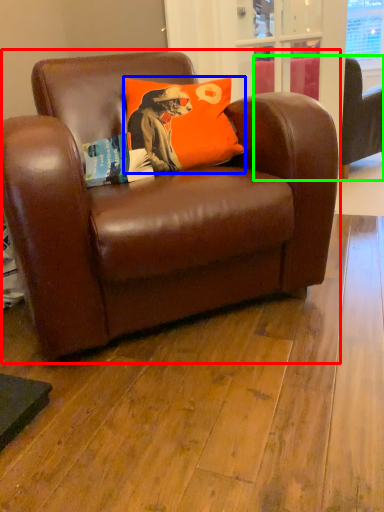
Question: Estimate the real-world distances between objects in this image. Which object is farther from chair (highlighted by a red box), pillow (highlighted by a blue box) or studio couch (highlighted by a green box)?

Choices:
 (A) pillow
 (B) studio couch

Answer: (B)